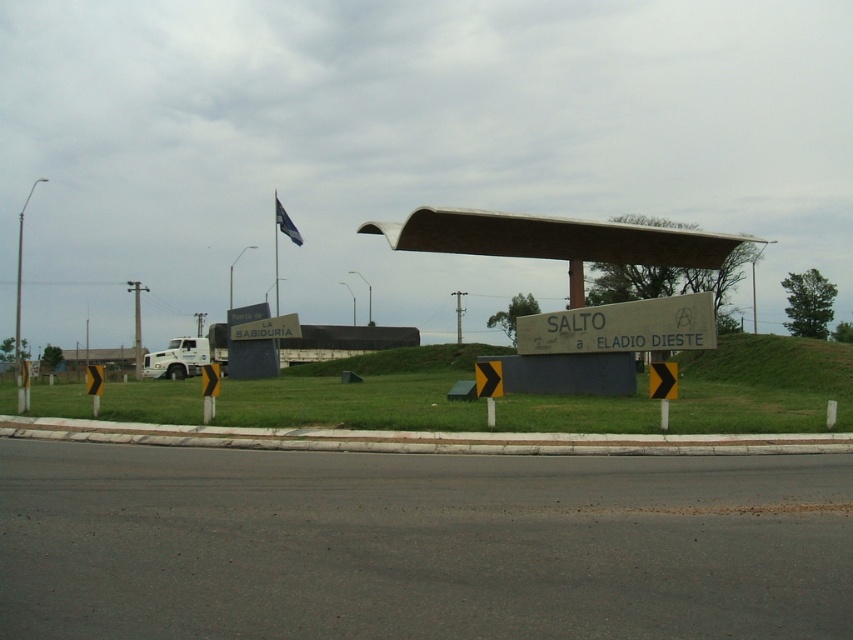
Question: Is concrete sign at center to the right of wooden sign at center from the viewer's perspective?

Choices:
 (A) no
 (B) yes

Answer: (B)

Question: Does wooden sign at center have a lesser width compared to blue fabric flag at upper center?

Choices:
 (A) yes
 (B) no

Answer: (A)

Question: Is brown corrugated metal canopy at center positioned in front of blue fabric flag at upper center?

Choices:
 (A) no
 (B) yes

Answer: (B)

Question: Which point appears closest to the camera in this image?

Choices:
 (A) (625, 257)
 (B) (322, 634)
 (C) (584, 317)
 (D) (553, 232)

Answer: (B)

Question: Which of the following is the closest to the observer?

Choices:
 (A) (496, 224)
 (B) (213, 602)

Answer: (B)

Question: Based on their relative distances, which object is nearer to the wooden sign at center?

Choices:
 (A) blue fabric flag at upper center
 (B) black asphalt highway at center
 (C) brown corrugated metal canopy at center
 (D) concrete sign at center

Answer: (D)